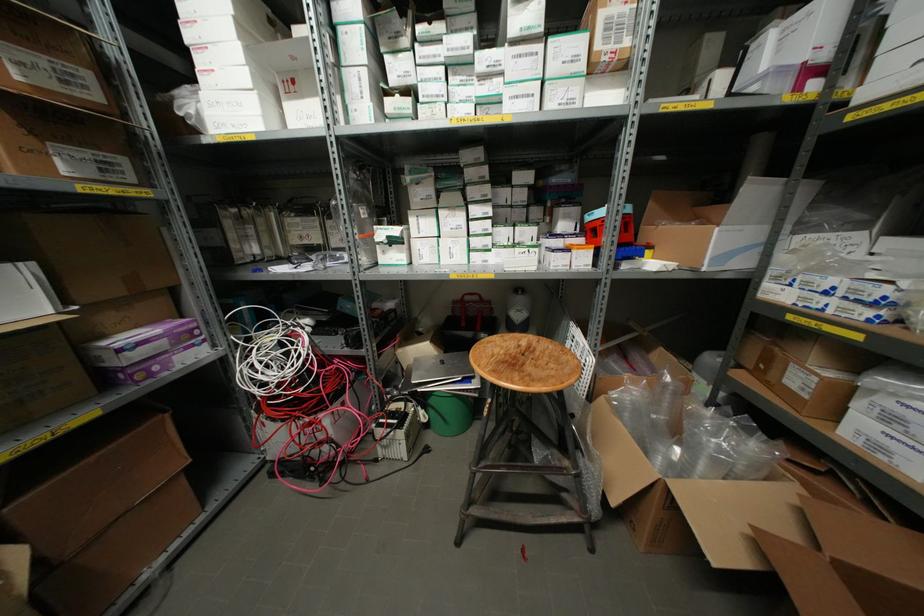
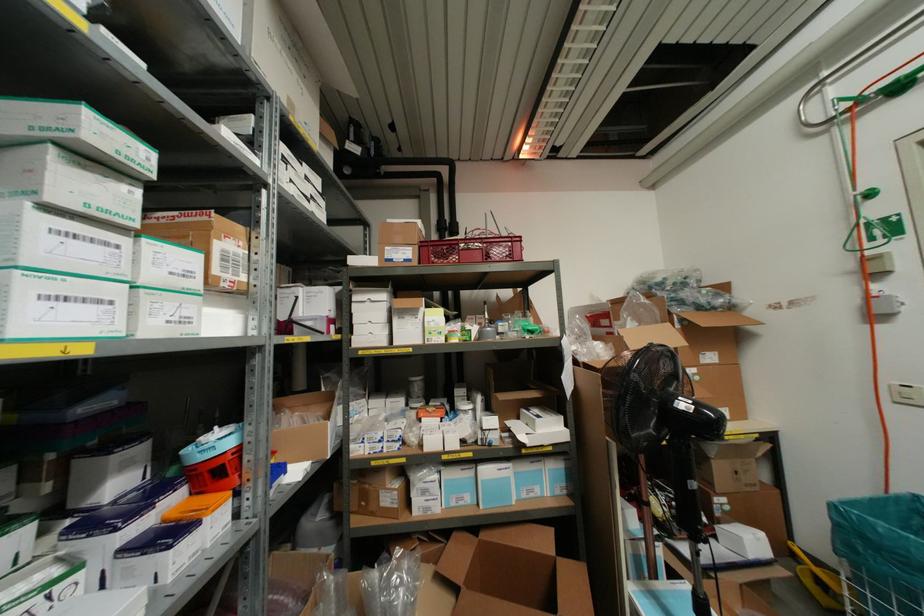
The point at (581, 66) is marked in the first image. Where is the corresponding point in the second image?

(196, 283)